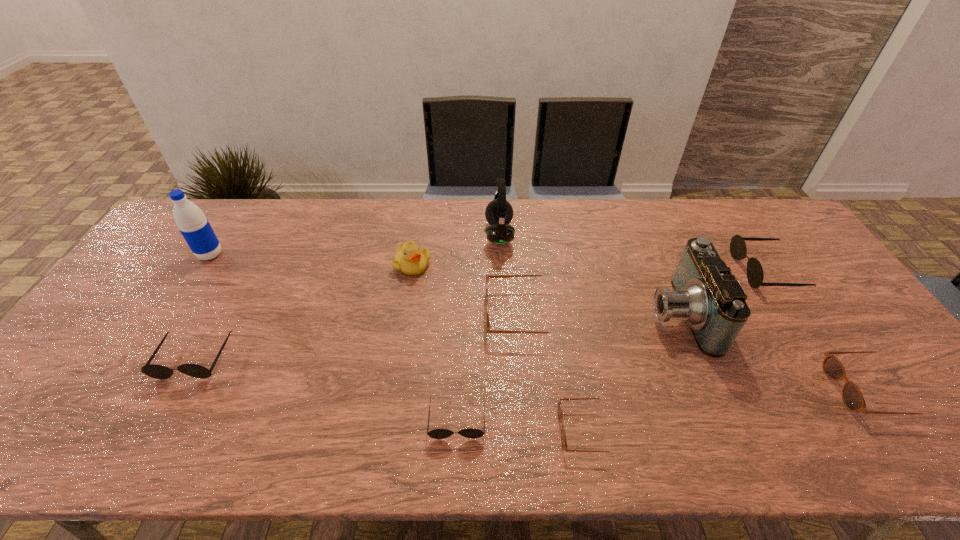
In order to click on the second biggest black sunglasses in this screenshot , I will do `click(155, 371)`.

Locate an element on the screen. This screenshot has height=540, width=960. the second nearest black sunglasses is located at coordinates (155, 371).

Where is `the rightmost brown sunglasses`? the rightmost brown sunglasses is located at coordinates [x=853, y=399].

Identify the location of the second sunglasses from left to right. coord(472,433).

The width and height of the screenshot is (960, 540). I want to click on the smallest black sunglasses, so click(x=472, y=433).

The height and width of the screenshot is (540, 960). I want to click on the smallest brown sunglasses, so click(563, 434).

I want to click on free space located on the right of the tallest object, so click(248, 255).

Where is `blank space located on the ear cups of the black headset`? Image resolution: width=960 pixels, height=540 pixels. blank space located on the ear cups of the black headset is located at coordinates (441, 234).

The width and height of the screenshot is (960, 540). I want to click on free space located 0.230m on the ear cups of the black headset, so click(x=417, y=234).

Locate an element on the screen. vacant space located on the ear cups of the black headset is located at coordinates (387, 234).